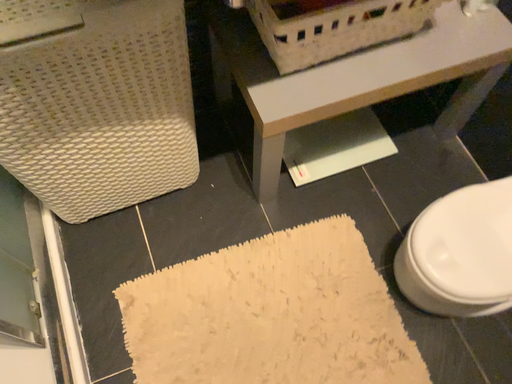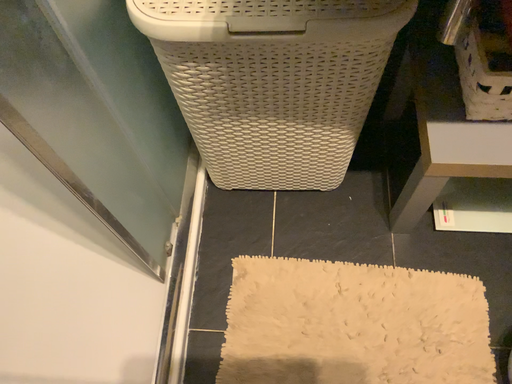
Question: Which way did the camera rotate in the video?

Choices:
 (A) rotated left
 (B) rotated right

Answer: (A)